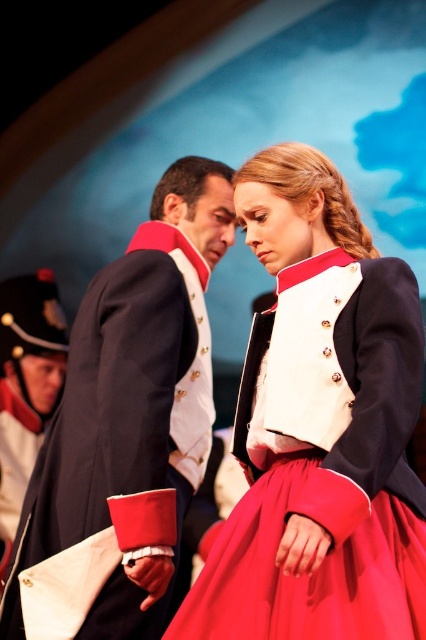
Question: Does matte black jacket at center lie behind navy blue uniform at center?

Choices:
 (A) no
 (B) yes

Answer: (A)

Question: Can you confirm if matte black jacket at center is positioned to the right of navy blue uniform at center?

Choices:
 (A) no
 (B) yes

Answer: (B)

Question: Can you confirm if matte black jacket at center is positioned to the right of navy blue uniform at center?

Choices:
 (A) no
 (B) yes

Answer: (B)

Question: Which of the following is the closest to the observer?

Choices:
 (A) (296, 492)
 (B) (28, 568)

Answer: (A)

Question: Which object is farther from the camera taking this photo?

Choices:
 (A) matte black jacket at center
 (B) navy blue uniform at center

Answer: (B)

Question: Which of the following is the closest to the observer?

Choices:
 (A) matte black jacket at center
 (B) navy blue uniform at center

Answer: (A)